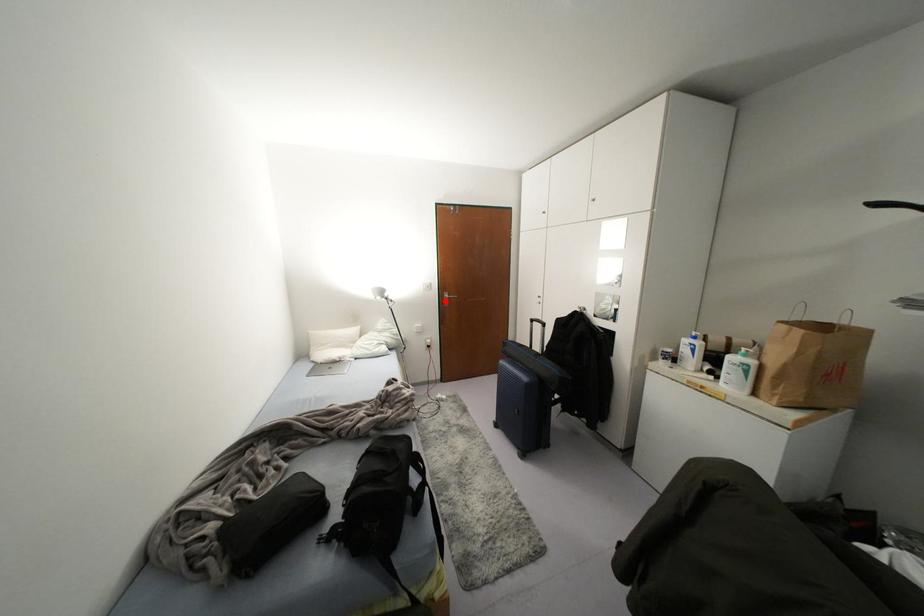
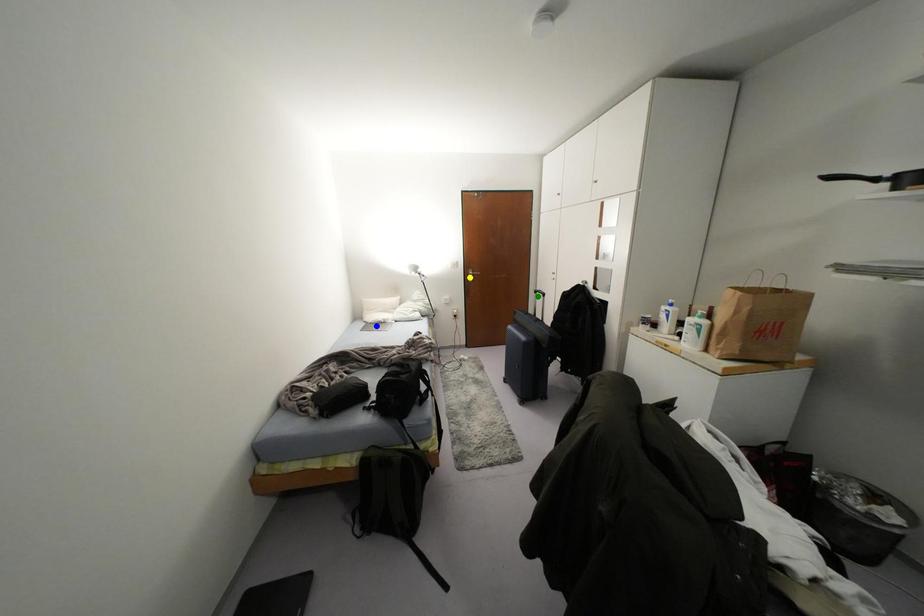
Question: I am providing you with two images of the same scene from different viewpoints. A red point is marked on the first image. You are given multiple points on the second image. Which spot in image 2 lines up with the point in image 1?

Choices:
 (A) blue point
 (B) yellow point
 (C) green point

Answer: (B)